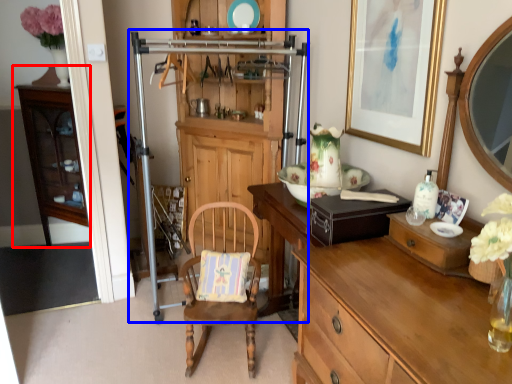
Question: Which point is further to the camera, cabinetry (highlighted by a red box) or dresser (highlighted by a blue box)?

Choices:
 (A) cabinetry
 (B) dresser

Answer: (A)